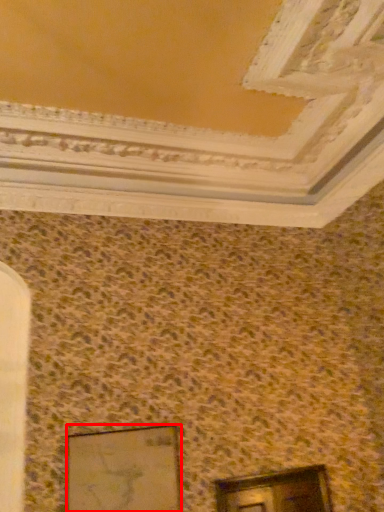
Question: From the image's perspective, what is the correct spatial positioning of picture frame (annotated by the red box) in reference to window?

Choices:
 (A) above
 (B) below

Answer: (A)